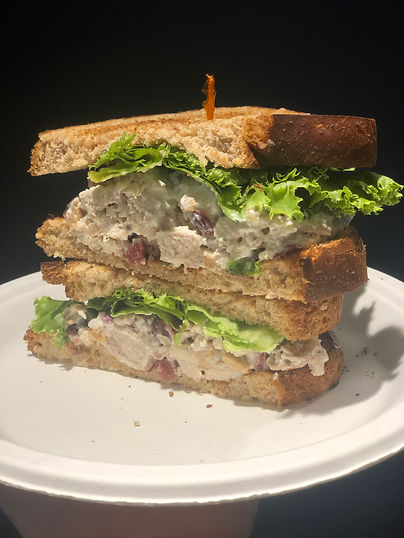
Where is `rim of plate`? rim of plate is located at coordinates [16, 482], [353, 472].